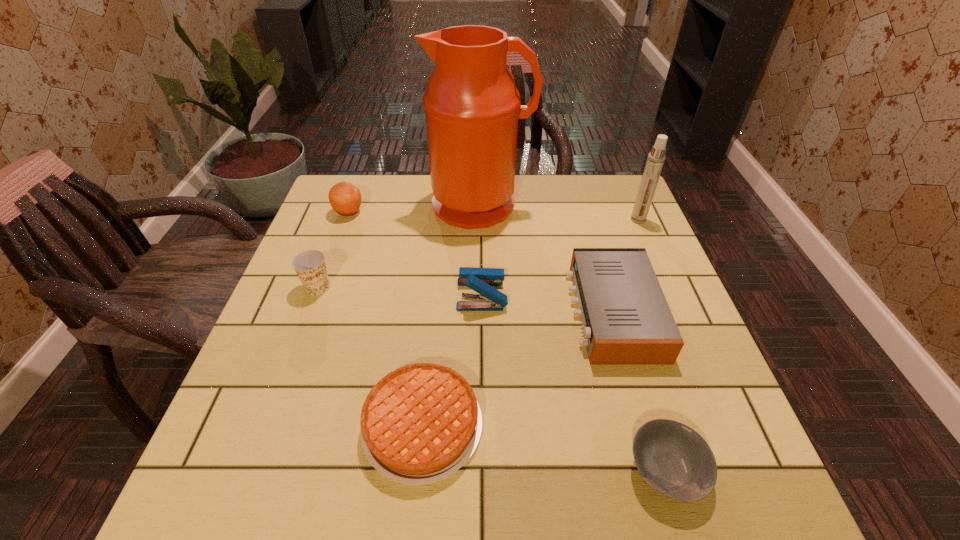
Locate an element on the screen. The width and height of the screenshot is (960, 540). aerosol can positioned at the far edge is located at coordinates 654,164.

This screenshot has height=540, width=960. I want to click on orange positioned at the far edge, so click(x=345, y=199).

Locate an element on the screen. This screenshot has height=540, width=960. pie that is at the near edge is located at coordinates (420, 423).

Where is `bowl positioned at the near edge`? The image size is (960, 540). bowl positioned at the near edge is located at coordinates (675, 460).

Locate an element on the screen. The image size is (960, 540). orange that is positioned at the left edge is located at coordinates (345, 199).

Identify the location of Dixie cup situated at the left edge. (310, 266).

The width and height of the screenshot is (960, 540). Find the location of `aerosol can that is at the right edge`. aerosol can that is at the right edge is located at coordinates (654, 164).

The height and width of the screenshot is (540, 960). Find the location of `radio receiver that is positioned at the right edge`. radio receiver that is positioned at the right edge is located at coordinates (626, 320).

Locate an element on the screen. The image size is (960, 540). bowl present at the right edge is located at coordinates (675, 460).

Find the location of a particular element. This screenshot has width=960, height=540. object that is at the far left corner is located at coordinates (345, 199).